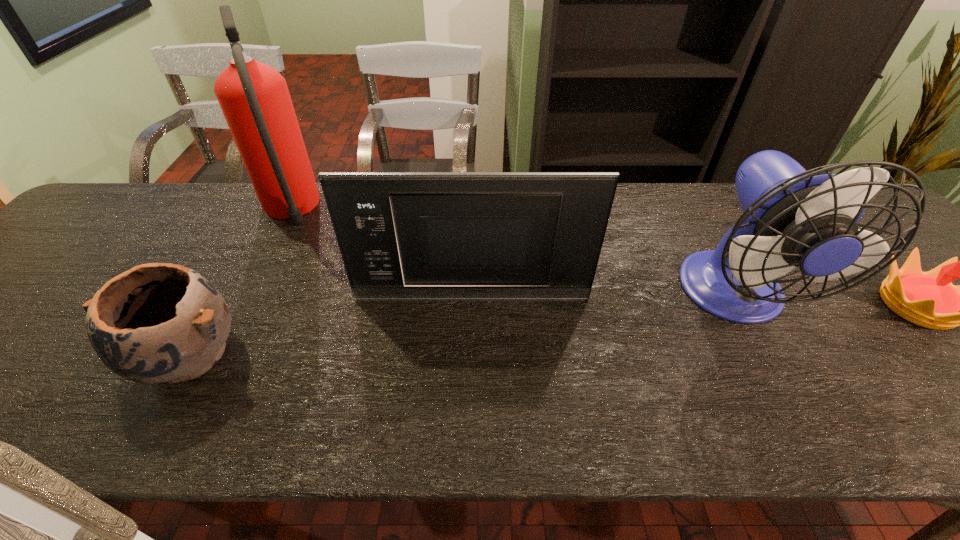
This screenshot has height=540, width=960. Identify the location of object located in the near edge section of the desktop. (158, 322).

The height and width of the screenshot is (540, 960). Identify the location of vacant space at the far edge of the desktop. (707, 219).

Find the location of a particular element. Image resolution: width=960 pixels, height=540 pixels. blank area at the near edge is located at coordinates (675, 404).

Find the location of a particular element. free space at the right edge of the desktop is located at coordinates (924, 339).

In order to click on free space between the pottery and the fire extinguisher in this screenshot , I will do `click(239, 284)`.

Where is `vacant space in between the fourth object from left to right and the pottery`? The width and height of the screenshot is (960, 540). vacant space in between the fourth object from left to right and the pottery is located at coordinates (462, 327).

The image size is (960, 540). In order to click on free spot between the fan and the microwave oven in this screenshot , I will do `click(603, 297)`.

In order to click on blank region between the third object from left to right and the fan in this screenshot , I will do `click(603, 297)`.

The height and width of the screenshot is (540, 960). Find the location of `free space between the fourth tallest object and the third object from left to right`. free space between the fourth tallest object and the third object from left to right is located at coordinates (330, 328).

Identify which object is the fourth nearest to the microwave oven. Please provide its 2D coordinates. Your answer should be formatted as a tuple, i.e. [(x, y)], where the tuple contains the x and y coordinates of a point satisfying the conditions above.

[(929, 299)]